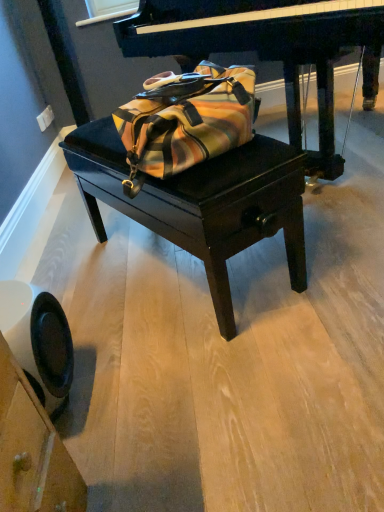
You are a GUI agent. You are given a task and a screenshot of the screen. Output one action in this format:
    pyautogui.click(x=<x>, y=<y>)
    Task: Click on the polished dark wood piano at center
    This screenshot has height=512, width=384.
    Given the screenshot: What is the action you would take?
    pyautogui.click(x=267, y=47)

What is the approximate width of polished dark wood piano at center?

polished dark wood piano at center is 1.60 meters in width.

Where is `black plastic swivel chair at lower left`? black plastic swivel chair at lower left is located at coordinates (38, 341).

Considering the relative sizes of velvet black table at center and black plastic swivel chair at lower left in the image provided, is velvet black table at center wider than black plastic swivel chair at lower left?

Yes.

Measure the distance from velvet black table at center to black plastic swivel chair at lower left.

velvet black table at center is 20.64 inches from black plastic swivel chair at lower left.

The width and height of the screenshot is (384, 512). What are the coordinates of `swivel chair below the velvet black table at center (from the image's perspective)` in the screenshot? It's located at (38, 341).

Is velvet black table at center at the back of polished dark wood piano at center?

No, polished dark wood piano at center's orientation is not away from velvet black table at center.

From a real-world perspective, is polished dark wood piano at center positioned above or below velvet black table at center?

Clearly, from a real-world perspective, polished dark wood piano at center is above velvet black table at center.

From the image's perspective, who appears lower, polished dark wood piano at center or velvet black table at center?

velvet black table at center, from the image's perspective.

Considering the positions of objects polished dark wood piano at center and velvet black table at center in the image provided, who is more to the left, polished dark wood piano at center or velvet black table at center?

velvet black table at center is more to the left.

Is polished dark wood piano at center next to black plastic swivel chair at lower left and touching it?

No, polished dark wood piano at center is not with black plastic swivel chair at lower left.

Which is more to the right, polished dark wood piano at center or black plastic swivel chair at lower left?

polished dark wood piano at center is more to the right.

From a real-world perspective, between polished dark wood piano at center and black plastic swivel chair at lower left, who is vertically higher?

polished dark wood piano at center is physically above.

Who is smaller, polished dark wood piano at center or black plastic swivel chair at lower left?

black plastic swivel chair at lower left.

From the picture: Between velvet black table at center and polished dark wood piano at center, which one is positioned behind?

Positioned behind is polished dark wood piano at center.

Considering the relative sizes of velvet black table at center and polished dark wood piano at center in the image provided, is velvet black table at center wider than polished dark wood piano at center?

No, velvet black table at center is not wider than polished dark wood piano at center.

Which object is positioned more to the left, velvet black table at center or polished dark wood piano at center?

From the viewer's perspective, velvet black table at center appears more on the left side.

Can we say velvet black table at center lies outside polished dark wood piano at center?

Absolutely, velvet black table at center is external to polished dark wood piano at center.

Is black plastic swivel chair at lower left to the left of velvet black table at center from the viewer's perspective?

Yes, black plastic swivel chair at lower left is to the left of velvet black table at center.

Which of these two, black plastic swivel chair at lower left or velvet black table at center, is wider?

With larger width is velvet black table at center.

Is velvet black table at center at the back of black plastic swivel chair at lower left?

No, black plastic swivel chair at lower left's orientation is not away from velvet black table at center.

Is the depth of black plastic swivel chair at lower left less than that of polished dark wood piano at center?

That is True.

Does black plastic swivel chair at lower left appear on the right side of polished dark wood piano at center?

No.

Considering the relative sizes of black plastic swivel chair at lower left and polished dark wood piano at center in the image provided, is black plastic swivel chair at lower left smaller than polished dark wood piano at center?

Indeed, black plastic swivel chair at lower left has a smaller size compared to polished dark wood piano at center.

Which of these two, black plastic swivel chair at lower left or polished dark wood piano at center, is thinner?

black plastic swivel chair at lower left is thinner.

Where is `swivel chair that is on the left side of velvet black table at center`? swivel chair that is on the left side of velvet black table at center is located at coordinates (38, 341).

You are a GUI agent. You are given a task and a screenshot of the screen. Output one action in this format:
    pyautogui.click(x=<x>, y=<y>)
    Task: Click on the piano that is on the right side of velvet black table at center
    This screenshot has height=512, width=384.
    Given the screenshot: What is the action you would take?
    pyautogui.click(x=267, y=47)

Consider the image. Looking at the image, which one is located closer to velvet black table at center, black plastic swivel chair at lower left or polished dark wood piano at center?

The object closer to velvet black table at center is black plastic swivel chair at lower left.

From the image, which object appears to be farther from black plastic swivel chair at lower left, polished dark wood piano at center or velvet black table at center?

Based on the image, polished dark wood piano at center appears to be further to black plastic swivel chair at lower left.

When comparing their distances from velvet black table at center, does polished dark wood piano at center or black plastic swivel chair at lower left seem further?

Based on the image, polished dark wood piano at center appears to be further to velvet black table at center.

Considering their positions, is velvet black table at center positioned further to polished dark wood piano at center than black plastic swivel chair at lower left?

Based on the image, black plastic swivel chair at lower left appears to be further to polished dark wood piano at center.

Looking at the image, which one is located closer to polished dark wood piano at center, black plastic swivel chair at lower left or velvet black table at center?

velvet black table at center is closer to polished dark wood piano at center.

Which object lies further to the anchor point black plastic swivel chair at lower left, velvet black table at center or polished dark wood piano at center?

polished dark wood piano at center.

Identify the location of table between polished dark wood piano at center and black plastic swivel chair at lower left in the up-down direction. (201, 203).